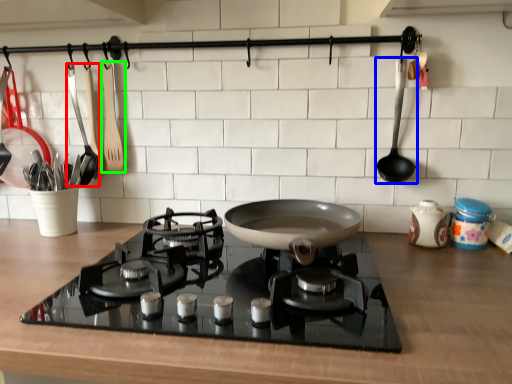
Question: Which object is the farthest from kitchen appliance (highlighted by a red box)? Choose among these: spoon (highlighted by a blue box) or kitchen appliance (highlighted by a green box).

Choices:
 (A) spoon
 (B) kitchen appliance

Answer: (A)